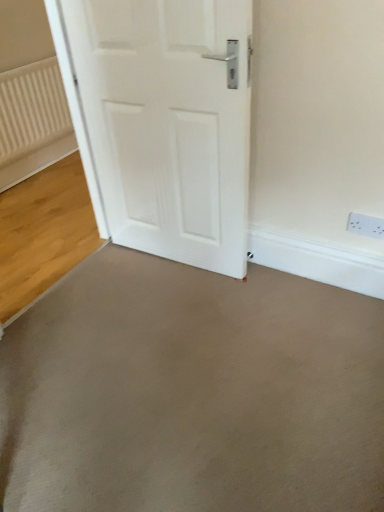
The width and height of the screenshot is (384, 512). What are the coordinates of `free space in front of white matte door at center` in the screenshot? It's located at (173, 321).